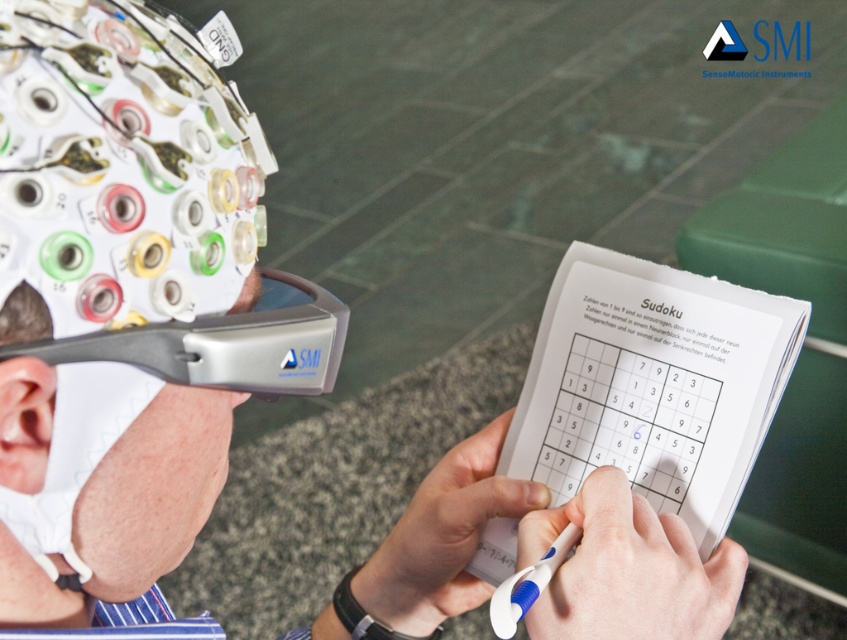
Question: Which point is farther from the camera taking this photo?

Choices:
 (A) (609, 282)
 (B) (247, 364)
 (C) (452, 609)

Answer: (C)

Question: Among these points, which one is farthest from the camera?

Choices:
 (A) (180, 372)
 (B) (637, 406)
 (C) (471, 531)

Answer: (C)

Question: Is the position of matte gray helmet at upper left more distant than that of silver metallic goggles at upper left?

Choices:
 (A) yes
 (B) no

Answer: (B)

Question: Which point is closer to the camera?

Choices:
 (A) silver metallic goggles at upper left
 (B) matte gray helmet at upper left

Answer: (B)

Question: Does white paper sudoku at center have a greater width compared to silver metallic goggles at upper left?

Choices:
 (A) no
 (B) yes

Answer: (B)

Question: Is white paper sudoku at center behind silver metallic goggles at upper left?

Choices:
 (A) no
 (B) yes

Answer: (B)